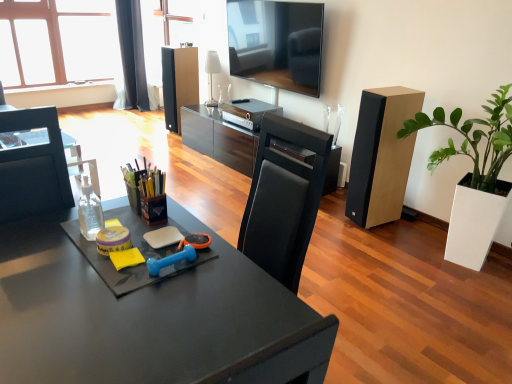
This screenshot has height=384, width=512. Identify the location of free region on the left part of yellow sponge at center. (62, 248).